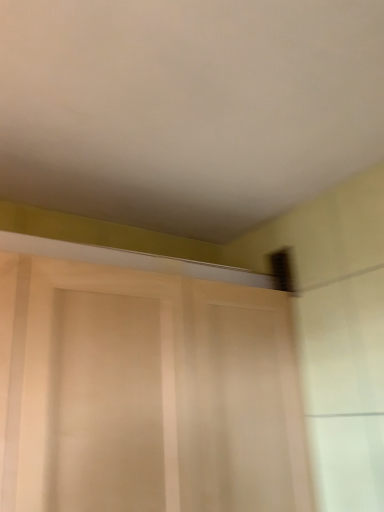
I want to click on matte wood door at center, so click(x=166, y=386).

What do you see at coordinates (166, 386) in the screenshot? I see `matte wood door at center` at bounding box center [166, 386].

Find the location of a particular element. matte wood door at center is located at coordinates (166, 386).